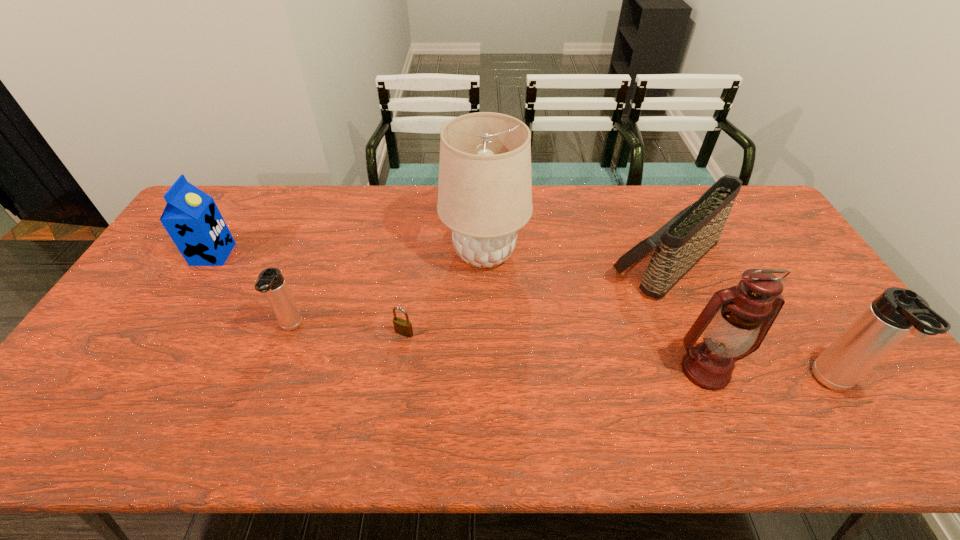
This screenshot has width=960, height=540. I want to click on the farther thermos bottle, so click(x=271, y=282).

The width and height of the screenshot is (960, 540). I want to click on the sixth tallest object, so click(x=271, y=282).

Where is `the taller thermos bottle`? This screenshot has width=960, height=540. the taller thermos bottle is located at coordinates (897, 312).

Locate an element on the screen. the rightmost object is located at coordinates (897, 312).

Where is `handbag`? handbag is located at coordinates (690, 234).

At what (x,y) coordinates should I click in order to perform the action: click on the leftmost object. Please return your answer as a coordinate pair (x, y). Image resolution: width=960 pixels, height=540 pixels. Looking at the image, I should click on (191, 217).

Locate an element on the screen. This screenshot has height=540, width=960. the shortest object is located at coordinates (403, 327).

Where is `padlock`? padlock is located at coordinates (403, 327).

Where is `the fourth object from right to left`? The image size is (960, 540). the fourth object from right to left is located at coordinates (485, 184).

The height and width of the screenshot is (540, 960). I want to click on oil lamp, so click(x=735, y=321).